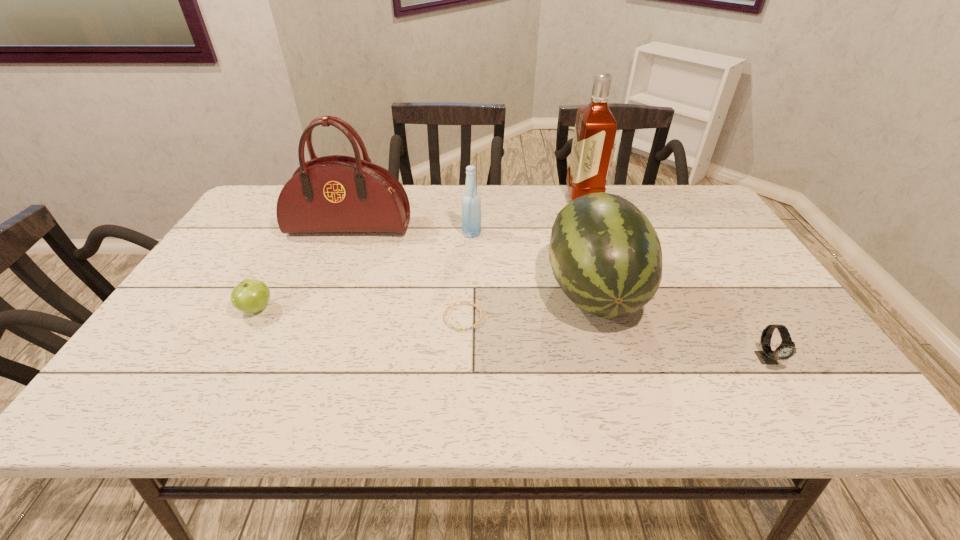
I want to click on vacant area between the rightmost object and the apple, so click(512, 334).

Identify the location of free point between the bottle and the handbag. The height and width of the screenshot is (540, 960). (411, 230).

This screenshot has height=540, width=960. Find the location of `vacant area that lies between the watermelon and the watch`. vacant area that lies between the watermelon and the watch is located at coordinates [681, 325].

You are a GUI agent. You are given a task and a screenshot of the screen. Output one action in this format:
    pyautogui.click(x=<x>, y=<y>)
    Task: Click on the vacant area that lies between the watch and the apple
    The image size is (960, 540).
    Given the screenshot: What is the action you would take?
    pyautogui.click(x=512, y=334)

Image resolution: width=960 pixels, height=540 pixels. I want to click on empty space that is in between the apple and the bottle, so click(x=364, y=271).

Find the location of a particular element. vacant area that lies between the apple and the liquor is located at coordinates (420, 254).

Identify the location of the third closest object relative to the watermelon. (786, 349).

Locate which object is the third closest to the bottle. Please provide its 2D coordinates. Your answer should be formatted as a tuple, i.e. [(x, y)], where the tuple contains the x and y coordinates of a point satisfying the conditions above.

[(456, 328)]

This screenshot has height=540, width=960. In order to click on vacant space that satisfies the following two spatial constraints: 1. on the front-facing side of the second tallest object; 2. on the right side of the watermelon in this screenshot , I will do `click(324, 291)`.

Locate an element on the screen. This screenshot has width=960, height=540. vacant space that satisfies the following two spatial constraints: 1. on the back side of the watermelon; 2. on the right side of the apple is located at coordinates (267, 291).